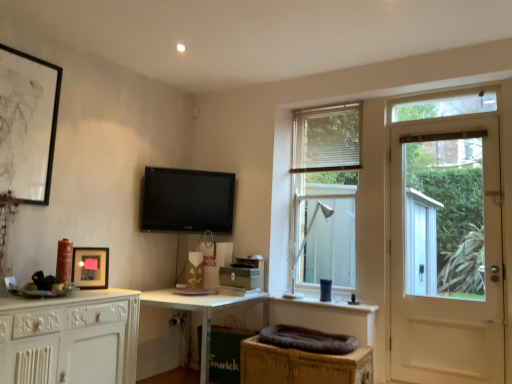
Question: From the image's perspective, is white metal table lamp at center below matte black picture frame at upper left, which appears as the second picture frame when viewed from the right?

Choices:
 (A) no
 (B) yes

Answer: (B)

Question: Is white metal table lamp at center turned away from matte black picture frame at upper left, which appears as the second picture frame when viewed from the right?

Choices:
 (A) no
 (B) yes

Answer: (A)

Question: From the image's perspective, is white metal table lamp at center located above matte black picture frame at upper left, which ranks as the 1th picture frame in left-to-right order?

Choices:
 (A) yes
 (B) no

Answer: (B)

Question: Can you confirm if white metal table lamp at center is positioned to the left of matte black picture frame at upper left, which appears as the second picture frame when viewed from the right?

Choices:
 (A) no
 (B) yes

Answer: (A)

Question: Considering the relative positions of white metal table lamp at center and matte black picture frame at upper left, the first picture frame in the top-to-bottom sequence, in the image provided, is white metal table lamp at center to the right of matte black picture frame at upper left, the first picture frame in the top-to-bottom sequence, from the viewer's perspective?

Choices:
 (A) no
 (B) yes

Answer: (B)

Question: Could matte black picture frame at upper left, the first picture frame in the top-to-bottom sequence, be considered to be inside white metal table lamp at center?

Choices:
 (A) no
 (B) yes

Answer: (A)

Question: Is white metal table lamp at center facing towards black glossy tv at upper center?

Choices:
 (A) no
 (B) yes

Answer: (A)

Question: Considering the relative positions of white metal table lamp at center and black glossy tv at upper center in the image provided, is white metal table lamp at center behind black glossy tv at upper center?

Choices:
 (A) no
 (B) yes

Answer: (A)

Question: Does white metal table lamp at center have a smaller size compared to black glossy tv at upper center?

Choices:
 (A) no
 (B) yes

Answer: (A)

Question: Can we say white metal table lamp at center lies outside black glossy tv at upper center?

Choices:
 (A) no
 (B) yes

Answer: (B)

Question: Considering the relative positions of white metal table lamp at center and black glossy tv at upper center in the image provided, is white metal table lamp at center to the left of black glossy tv at upper center from the viewer's perspective?

Choices:
 (A) no
 (B) yes

Answer: (A)

Question: Considering the relative sizes of white metal table lamp at center and black glossy tv at upper center in the image provided, is white metal table lamp at center bigger than black glossy tv at upper center?

Choices:
 (A) no
 (B) yes

Answer: (B)

Question: Is matte black picture frame at left, the 2th picture frame viewed from the left, wider than white metal table lamp at center?

Choices:
 (A) yes
 (B) no

Answer: (B)